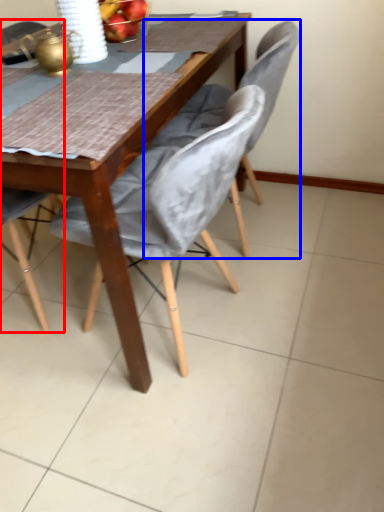
Question: Among these objects, which one is nearest to the camera, chair (highlighted by a red box) or chair (highlighted by a blue box)?

Choices:
 (A) chair
 (B) chair

Answer: (A)